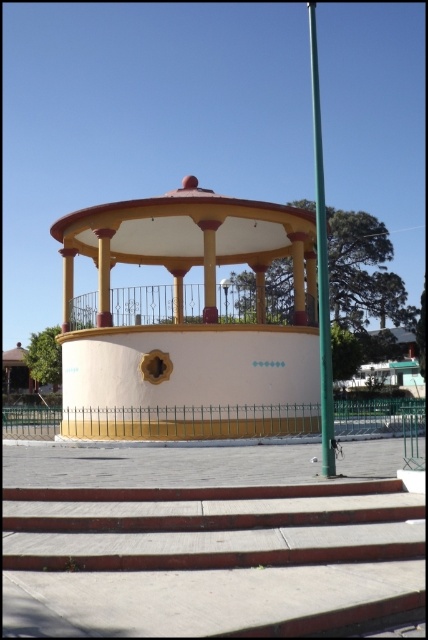
You are planning to install a ramp for accessibility from the concrete steps at center to the matte yellow gazebo at center. The ramp must have a slope of 1 foot of horizontal space for every 1 inch of vertical rise. If the steps are 2 feet high, how much horizontal space in feet will the ramp require?

The ramp requires a slope of 1 foot of horizontal space for every 1 inch of vertical rise. The steps are 2 feet high, which is 24 inches. Therefore, the horizontal space needed is 24 feet. Since the distance between the concrete steps at center and matte yellow gazebo at center is 40.93 feet, there is sufficient space to accommodate the ramp.

You are a delivery person trying to park your 1.2 meter wide cart between the concrete steps at center and the green metallic pole at right. Based on the scene, can your cart fit in the space between them?

The concrete steps at center is thinner than green metallic pole at right, so the space between them might be narrower than 1.2 meters. Therefore, the cart may not fit comfortably between the concrete steps at center and the green metallic pole at right.